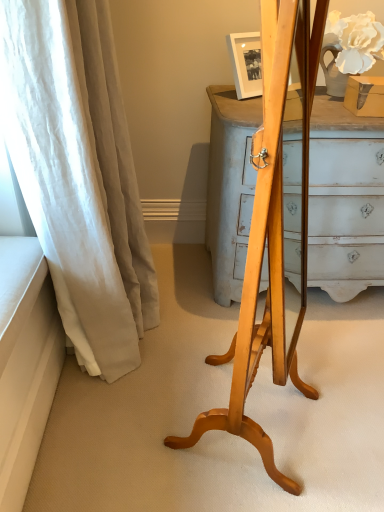
Find the location of a particular element. The height and width of the screenshot is (512, 384). light wood easel at center is located at coordinates (270, 234).

The height and width of the screenshot is (512, 384). Describe the element at coordinates (270, 234) in the screenshot. I see `light wood easel at center` at that location.

In order to face light wood easel at center, should I rotate leftwards or rightwards?

Turn right by 10.148 degrees to look at light wood easel at center.

The image size is (384, 512). In order to click on white linen curtain at left in this screenshot , I will do `click(78, 174)`.

Describe the element at coordinates (78, 174) in the screenshot. The width and height of the screenshot is (384, 512). I see `white linen curtain at left` at that location.

Locate an element on the screen. This screenshot has width=384, height=512. light wood easel at center is located at coordinates (270, 234).

Between white linen curtain at left and light wood easel at center, which one appears on the right side from the viewer's perspective?

Positioned to the right is light wood easel at center.

Which is behind, white linen curtain at left or light wood easel at center?

Positioned behind is white linen curtain at left.

Considering the positions of point (33, 1) and point (261, 168), is point (33, 1) closer or farther from the camera than point (261, 168)?

Point (33, 1) appears to be farther away from the viewer than point (261, 168).

From the image's perspective, is white linen curtain at left located above or below light wood easel at center?

From the image's perspective, white linen curtain at left appears above light wood easel at center.

From a real-world perspective, which object rests below the other?

In real-world perspective, white linen curtain at left is lower.

Considering the relative sizes of white linen curtain at left and light wood easel at center in the image provided, is white linen curtain at left thinner than light wood easel at center?

Incorrect, the width of white linen curtain at left is not less than that of light wood easel at center.

In terms of height, does white linen curtain at left look taller or shorter compared to light wood easel at center?

Clearly, white linen curtain at left is shorter compared to light wood easel at center.

Who is smaller, white linen curtain at left or light wood easel at center?

With smaller size is light wood easel at center.

Can we say white linen curtain at left lies outside light wood easel at center?

Absolutely, white linen curtain at left is external to light wood easel at center.

Are white linen curtain at left and light wood easel at center making contact?

No, white linen curtain at left is not making contact with light wood easel at center.

Consider the image. Could you tell me if white linen curtain at left is turned towards light wood easel at center?

No, white linen curtain at left is not aimed at light wood easel at center.

How far apart are white linen curtain at left and light wood easel at center?

white linen curtain at left is 20.47 inches from light wood easel at center.

Identify the location of curtain on the left of light wood easel at center. (78, 174).

Which object is positioned more to the left, light wood easel at center or white linen curtain at left?

Positioned to the left is white linen curtain at left.

Relative to white linen curtain at left, is light wood easel at center in front or behind?

Visually, light wood easel at center is located in front of white linen curtain at left.

Which is in front, point (268, 209) or point (41, 162)?

The point (268, 209) is in front.

From the image's perspective, is light wood easel at center above or below white linen curtain at left?

Clearly, from the image's perspective, light wood easel at center is below white linen curtain at left.

From a real-world perspective, is light wood easel at center under white linen curtain at left?

No, from a real-world perspective, light wood easel at center is not under white linen curtain at left.

Is light wood easel at center wider or thinner than white linen curtain at left?

light wood easel at center is thinner than white linen curtain at left.

Which of these two, light wood easel at center or white linen curtain at left, stands taller?

light wood easel at center is taller.

Consider the image. Which of these two, light wood easel at center or white linen curtain at left, is bigger?

white linen curtain at left.

Can white linen curtain at left be found inside light wood easel at center?

No, white linen curtain at left is not surrounded by light wood easel at center.

Is light wood easel at center not close to white linen curtain at left?

No, light wood easel at center is not far away from white linen curtain at left.

Is light wood easel at center looking in the opposite direction of white linen curtain at left?

Absolutely, light wood easel at center is directed away from white linen curtain at left.

Can you tell me how much light wood easel at center and white linen curtain at left differ in facing direction?

light wood easel at center and white linen curtain at left are facing 64.4 degrees away from each other.

The image size is (384, 512). Find the location of `curtain on the left of light wood easel at center`. curtain on the left of light wood easel at center is located at coordinates (78, 174).

Locate an element on the screen. The height and width of the screenshot is (512, 384). curtain lying above the light wood easel at center (from the image's perspective) is located at coordinates (78, 174).

This screenshot has height=512, width=384. I want to click on easel in front of the white linen curtain at left, so click(x=270, y=234).